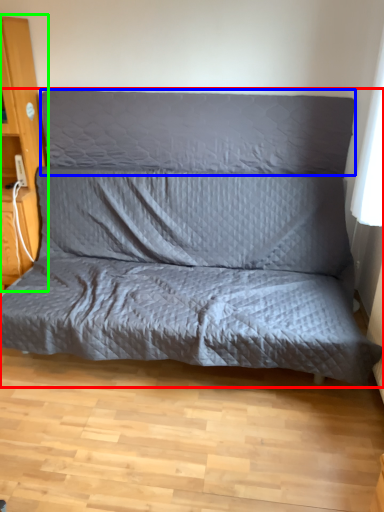
Question: Which is farther away from studio couch (highlighted by a red box)? pillow (highlighted by a blue box) or dresser (highlighted by a green box)?

Choices:
 (A) pillow
 (B) dresser

Answer: (B)